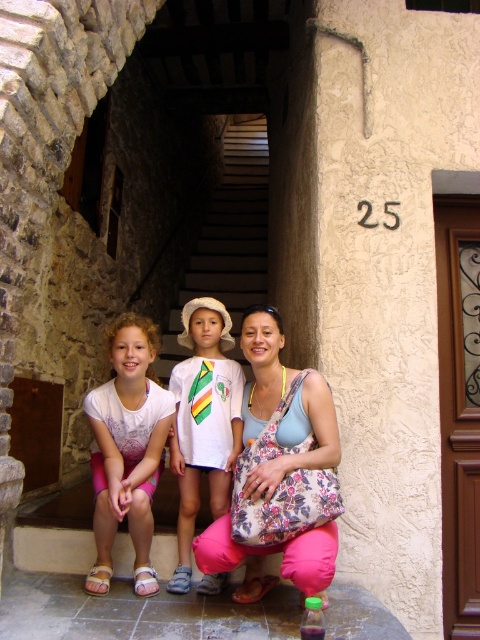
You are taking a photo of the building and want to focus on two specific points. The first point is at coordinates point (120, 362) and the second is at point (184, 332). Which point should you focus on first if you want to start with the closest one to the camera?

You should focus on point (120, 362) first because it is closer to the camera than point (184, 332) according to the description.